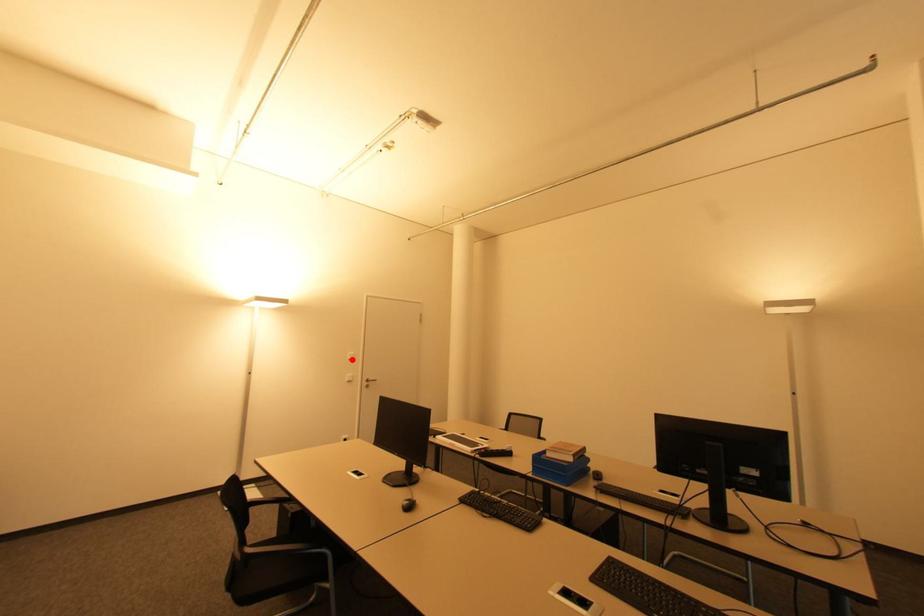
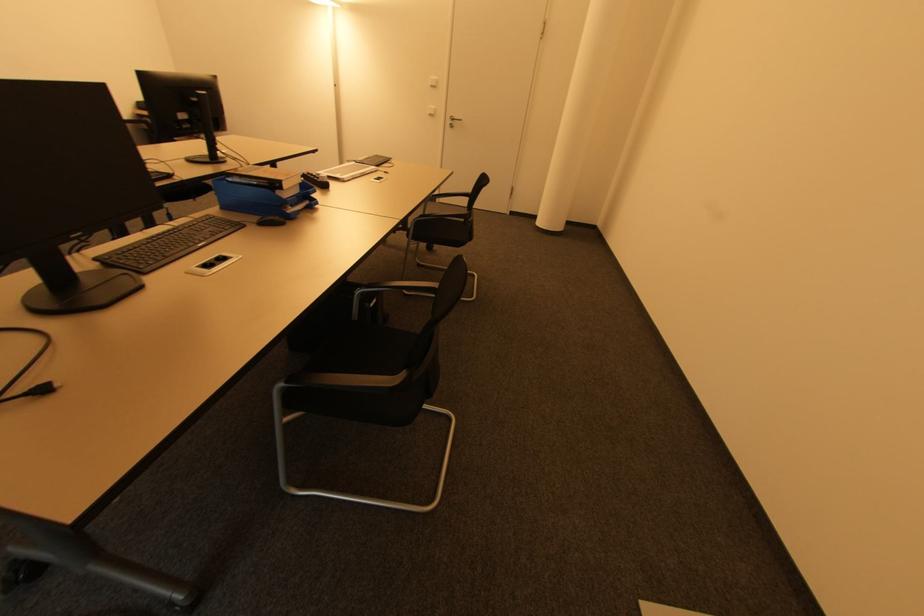
Question: I am providing you with two images of the same scene from different viewpoints. A red point is marked on the first image. Can you still see the location of the red point in image 2?

Choices:
 (A) Yes
 (B) No

Answer: (A)